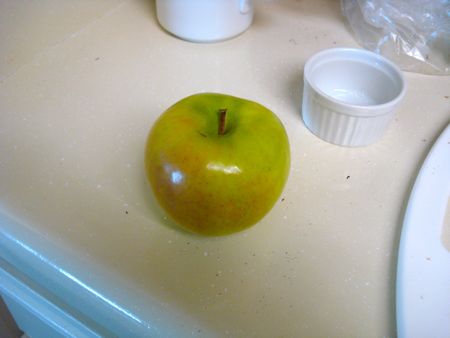
Locate an element on the screen. This screenshot has height=338, width=450. ramakin is located at coordinates (352, 107).